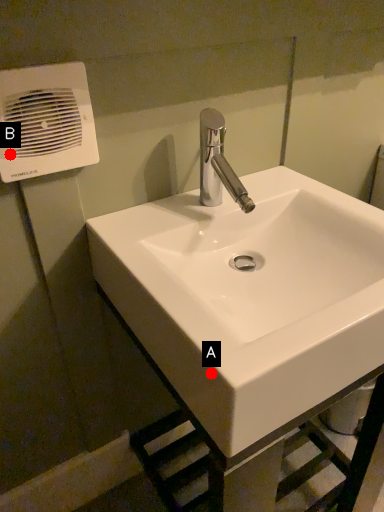
Question: Two points are circled on the image, labeled by A and B beside each circle. Among these points, which one is farthest from the camera?

Choices:
 (A) A is further
 (B) B is further

Answer: (B)